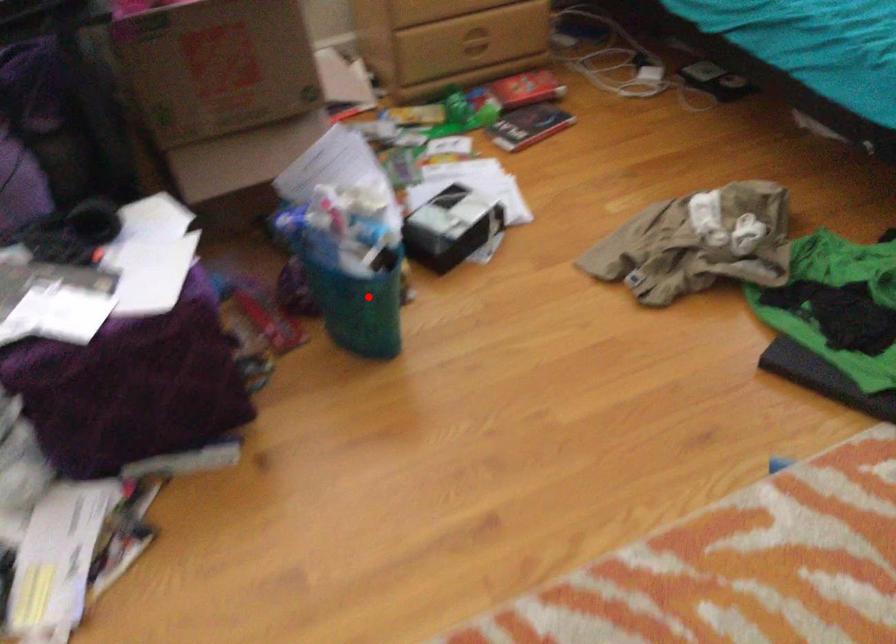
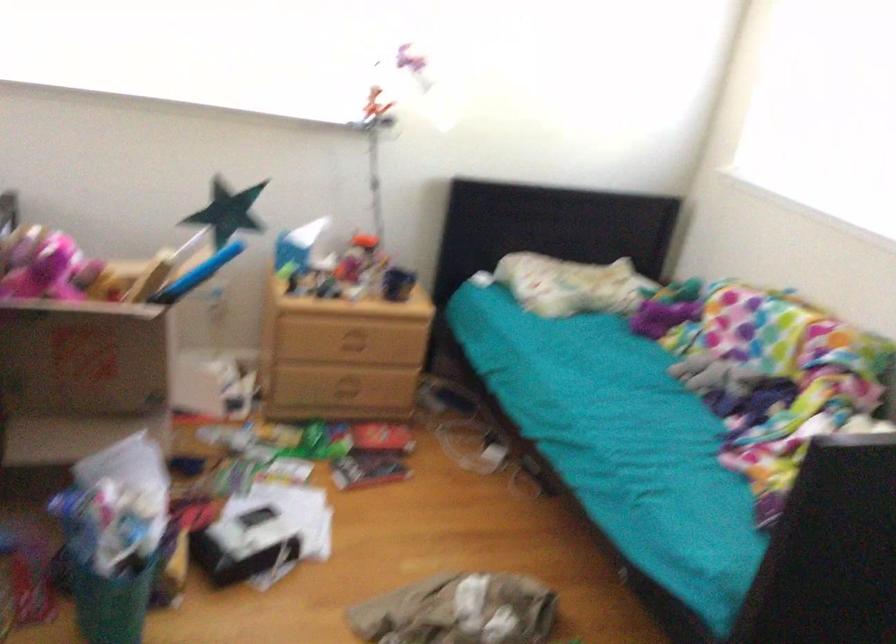
Question: I am providing you with two images of the same scene from different viewpoints. A red point is marked on the first image. At the location where the point appears in image 1, is it still visible in image 2?

Choices:
 (A) Yes
 (B) No

Answer: (A)